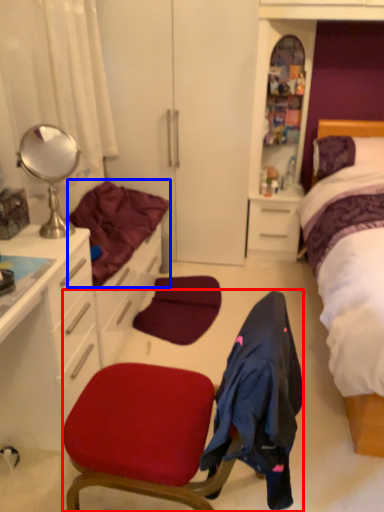
Question: Which of the following is the closest to the observer, chair (highlighted by a red box) or bedding (highlighted by a blue box)?

Choices:
 (A) chair
 (B) bedding

Answer: (A)